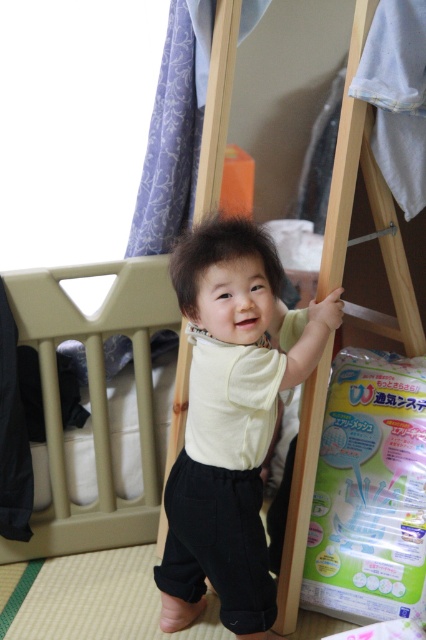
You are a delivery person holding a package that is 1.5 meters long. You need to place it in this room without blocking the camera view. Is the space between the matte yellow shirt at center and the camera sufficient to fit the package horizontally?

The distance between the matte yellow shirt at center and the camera is 1.28 meters. Since the package is 1.5 meters long, it cannot fit in the available space as it is longer than the distance provided.

You are a photographer standing in the room. You see two points marked in the image. The first point is at coordinates point (267, 556) and the second point is at point (305, 460). Which point is closer to you?

Point (267, 556) is closer to the viewer than point (305, 460).